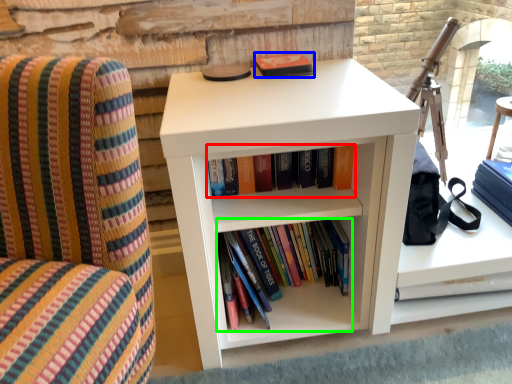
Question: Considering the real-world distances, which object is closest to book (highlighted by a red box)? paperback book (highlighted by a blue box) or book (highlighted by a green box).

Choices:
 (A) paperback book
 (B) book

Answer: (B)